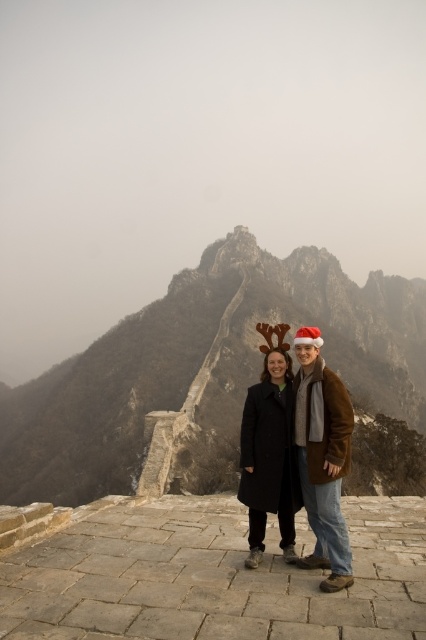
Is rugged stone wall at center below matte black coat at center?

Actually, rugged stone wall at center is above matte black coat at center.

Can you confirm if rugged stone wall at center is positioned to the right of matte black coat at center?

Indeed, rugged stone wall at center is positioned on the right side of matte black coat at center.

Is point (420, 285) in front of point (305, 460)?

No.

At what (x,y) coordinates should I click in order to perform the action: click on rugged stone wall at center. Please return your answer as a coordinate pair (x, y). This screenshot has width=426, height=640. Looking at the image, I should click on (215, 376).

Which is in front, point (193, 340) or point (258, 502)?

Point (258, 502) is more forward.

Is rugged stone wall at center further to the viewer compared to black wool coat at center?

Yes, rugged stone wall at center is further from the viewer.

Who is more distant from viewer, (371, 349) or (285, 547)?

The point (371, 349) is more distant.

Find the location of `rugged stone wall at center`. rugged stone wall at center is located at coordinates (215, 376).

Is matte black coat at center above black wool coat at center?

Correct, matte black coat at center is located above black wool coat at center.

Locate an element on the screen. matte black coat at center is located at coordinates (322, 458).